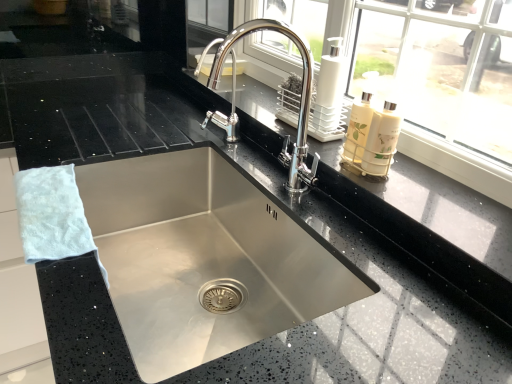
Question: Is white fluffy hand towel at left inside or outside of white glossy soap dispenser at upper right?

Choices:
 (A) outside
 (B) inside

Answer: (A)

Question: Considering the positions of white fluffy hand towel at left and white glossy soap dispenser at upper right in the image, is white fluffy hand towel at left wider or thinner than white glossy soap dispenser at upper right?

Choices:
 (A) wide
 (B) thin

Answer: (A)

Question: Which of these objects is positioned closest to the white glossy soap dispenser at upper right?

Choices:
 (A) stainless steel sink at center
 (B) white fluffy hand towel at left
 (C) polished chrome faucet at center

Answer: (C)

Question: Estimate the real-world distances between objects in this image. Which object is closer to the white fluffy hand towel at left?

Choices:
 (A) polished chrome faucet at center
 (B) white glossy soap dispenser at upper right
 (C) stainless steel sink at center

Answer: (C)